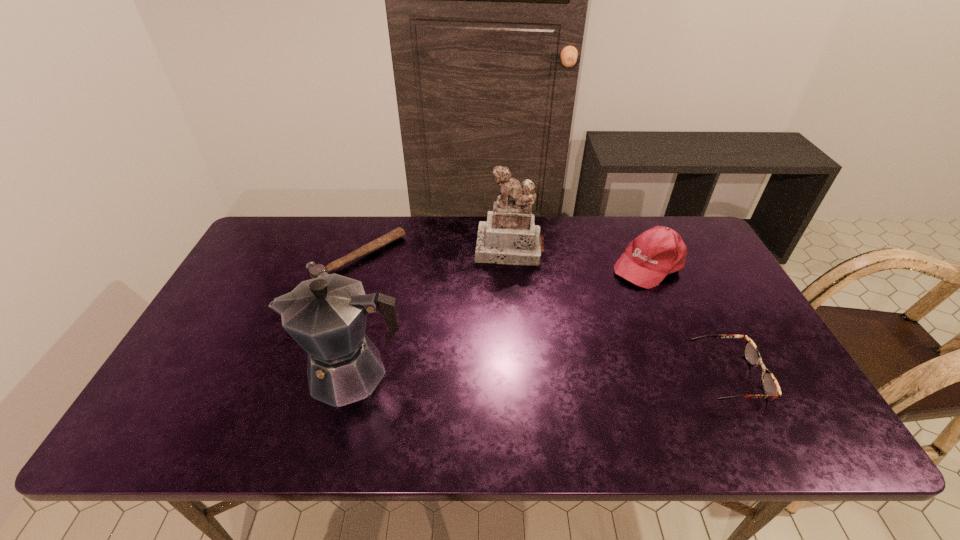
What are the coordinates of `free spot located on the front-facing side of the figurine` in the screenshot? It's located at (502, 324).

Where is `vacant region located 0.300m on the front-facing side of the figurine`? Image resolution: width=960 pixels, height=540 pixels. vacant region located 0.300m on the front-facing side of the figurine is located at coordinates (501, 341).

You are a GUI agent. You are given a task and a screenshot of the screen. Output one action in this format:
    pyautogui.click(x=<x>, y=<y>)
    Task: Click on the blank space located on the front-facing side of the figurine
    
    Given the screenshot: What is the action you would take?
    pyautogui.click(x=503, y=316)

The width and height of the screenshot is (960, 540). What are the coordinates of `vacant space situated on the striking face of the hammer` in the screenshot? It's located at (410, 305).

Locate an element on the screen. This screenshot has height=540, width=960. vacant position located on the striking face of the hammer is located at coordinates (444, 334).

At what (x,y) coordinates should I click in order to perform the action: click on free spot located 0.120m on the striking face of the hammer. Please return your answer as a coordinate pair (x, y). This screenshot has height=540, width=960. Looking at the image, I should click on (408, 302).

Locate an element on the screen. The image size is (960, 540). baseball cap that is at the far edge is located at coordinates (649, 258).

The height and width of the screenshot is (540, 960). Identify the location of figurine that is at the far edge. (510, 236).

What are the coordinates of `hammer that is at the far edge` in the screenshot? It's located at (315, 270).

Find the location of a particular element. Image resolution: width=960 pixels, height=540 pixels. coffeepot present at the near edge is located at coordinates (326, 316).